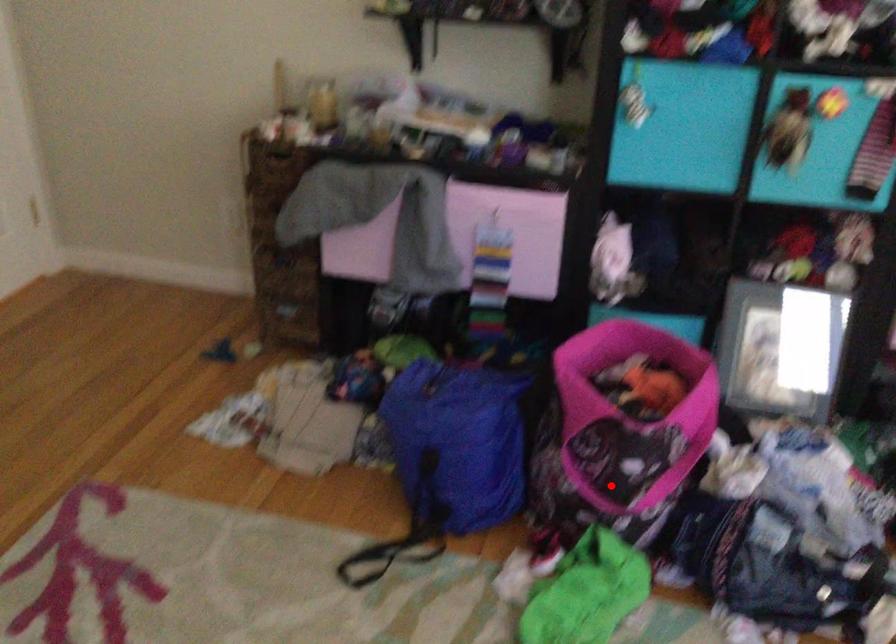
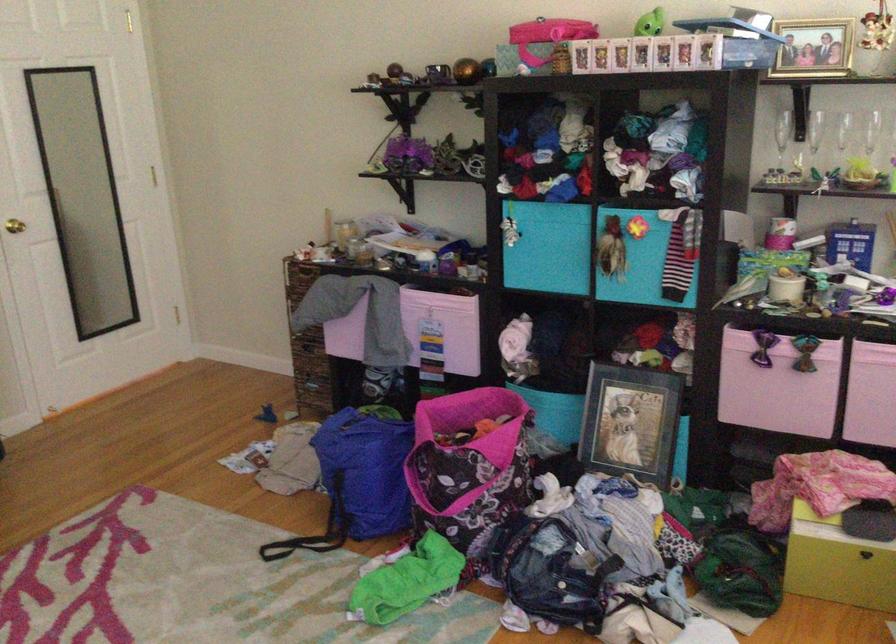
The point at the highlighted location is marked in the first image. Where is the corresponding point in the second image?

(440, 498)